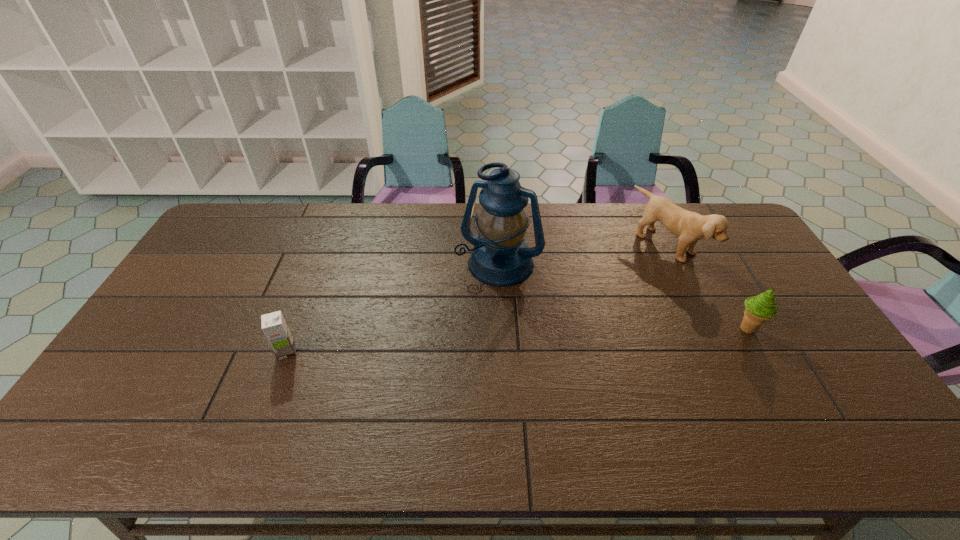
I want to click on free point at the right edge, so click(x=798, y=323).

Where is `vacant space at the far left corner of the desktop`? This screenshot has height=540, width=960. vacant space at the far left corner of the desktop is located at coordinates (230, 224).

Identify the location of vacant space at the far right corner of the desktop. Image resolution: width=960 pixels, height=540 pixels. (737, 223).

Where is `empty space that is in between the tallest object and the second nearest object`? empty space that is in between the tallest object and the second nearest object is located at coordinates click(x=623, y=296).

You are a GUI agent. You are given a task and a screenshot of the screen. Output one action in this format:
    pyautogui.click(x=<x>, y=<y>)
    Task: Click on the vacant area that lies between the puppy and the shortest object
    This screenshot has width=960, height=540.
    Given the screenshot: What is the action you would take?
    pyautogui.click(x=478, y=299)

Identify the location of empty space between the puppy and the third object from right to left. The image size is (960, 540). (585, 255).

What are the coordinates of `empty location between the puppy and the second nearest object` in the screenshot? It's located at (708, 287).

What are the coordinates of `empty space that is in between the nearest object and the tallest object` in the screenshot? It's located at (393, 308).

Find the location of a particular element. vacant space that's between the leftmost object and the second nearest object is located at coordinates (517, 340).

You are a GUI agent. You are given a task and a screenshot of the screen. Output one action in this format:
    pyautogui.click(x=<x>, y=<y>)
    Task: Click on the vacant area that lies between the third object from right to left and the puppy
    The image size is (960, 540).
    Given the screenshot: What is the action you would take?
    pyautogui.click(x=585, y=255)